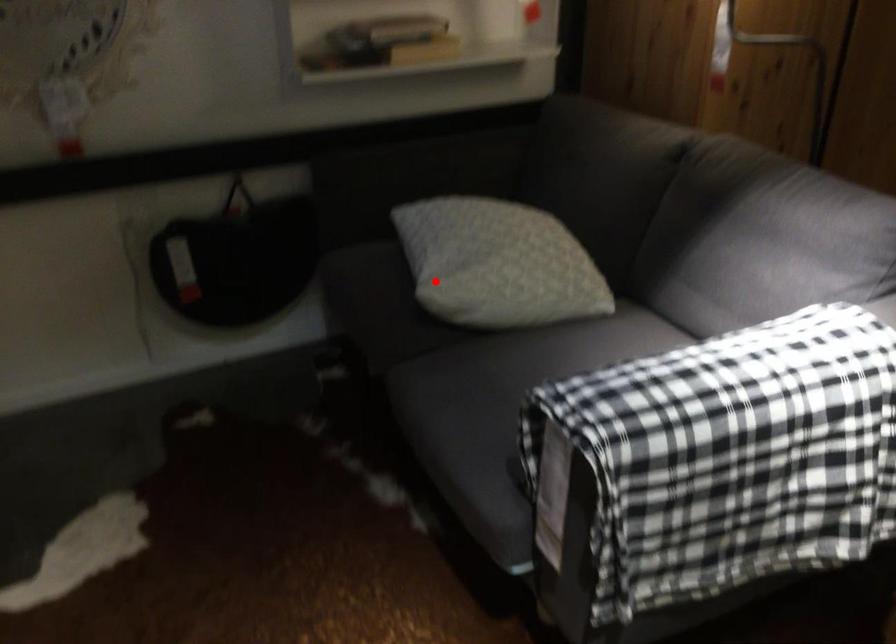
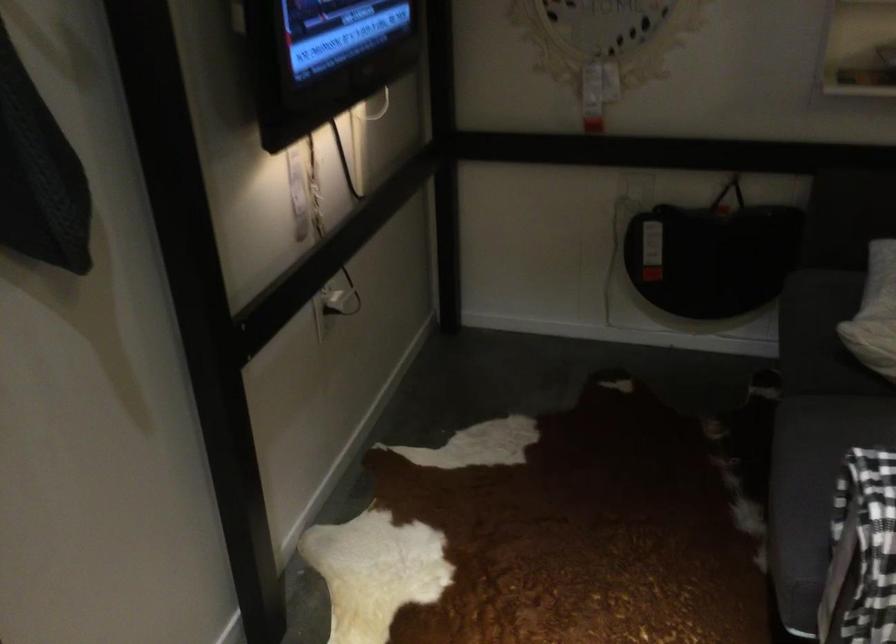
Question: I am providing you with two images of the same scene from different viewpoints. A red point is marked on the first image. Can you still see the location of the red point in image 2?

Choices:
 (A) Yes
 (B) No

Answer: (A)